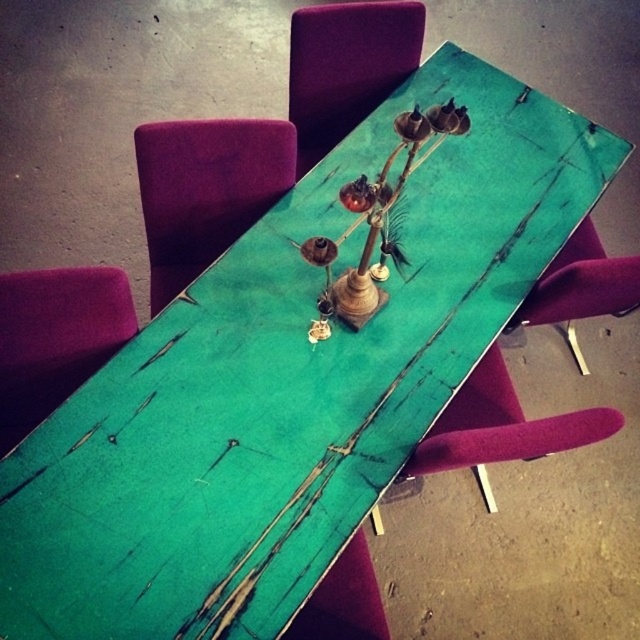
Does purple fabric chair at left have a smaller size compared to teal wood chair at center?

Yes.

Who is more forward, (52, 378) or (618, 273)?

Positioned in front is point (618, 273).

Where is `purple fabric chair at left`? Image resolution: width=640 pixels, height=640 pixels. purple fabric chair at left is located at coordinates (54, 339).

Where is `purple fabric chair at center`? The image size is (640, 640). purple fabric chair at center is located at coordinates (205, 189).

Can you confirm if purple fabric chair at center is taller than velvet magenta chair at lower right?

Yes, purple fabric chair at center is taller than velvet magenta chair at lower right.

The image size is (640, 640). What are the coordinates of `purple fabric chair at center` in the screenshot? It's located at (205, 189).

The height and width of the screenshot is (640, 640). What are the coordinates of `purple fabric chair at center` in the screenshot? It's located at (205, 189).

Can you confirm if purple fabric chair at left is positioned to the right of velvet magenta chair at lower right?

In fact, purple fabric chair at left is to the left of velvet magenta chair at lower right.

Who is taller, purple fabric chair at left or velvet magenta chair at lower right?

purple fabric chair at left

Measure the distance between point (x=83, y=330) and camera.

Point (x=83, y=330) and camera are 1.46 meters apart.

Image resolution: width=640 pixels, height=640 pixels. What are the coordinates of `purple fabric chair at left` in the screenshot? It's located at (54, 339).